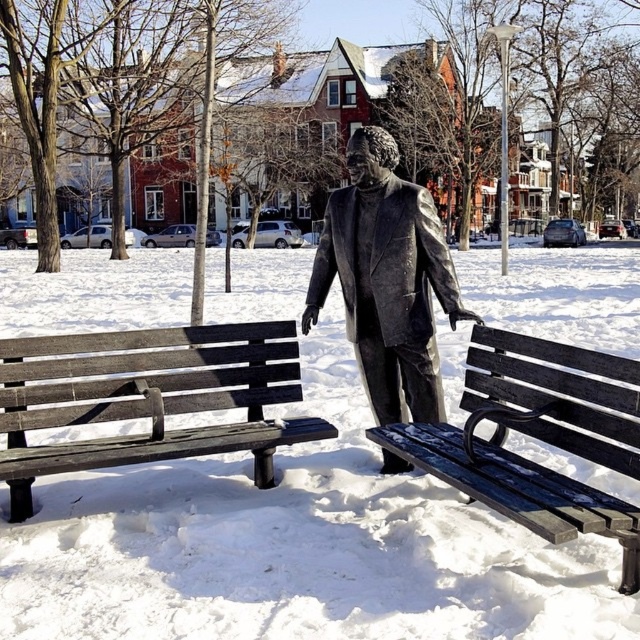
Between point (339, 422) and point (234, 348), which one is positioned in front?

Point (234, 348)

Who is higher up, white matte snow at center or wooden bench at left?

white matte snow at center is above.

Is point (339, 307) positioned after point (76, 456)?

Yes, point (339, 307) is behind point (76, 456).

What are the coordinates of `white matte snow at center` in the screenshot? It's located at (296, 545).

Does white matte snow at center come in front of bronze statue at center?

Yes, it is.

Measure the distance between white matte snow at center and camera.

white matte snow at center is 8.83 feet away from camera.

I want to click on white matte snow at center, so click(296, 545).

Is white matte snow at center below dark wood bench at center?

Incorrect, white matte snow at center is not positioned below dark wood bench at center.

Which of these two, white matte snow at center or dark wood bench at center, stands taller?

With more height is white matte snow at center.

Does point (168, 496) come closer to viewer compared to point (520, 476)?

That is False.

Find the location of `white matte snow at center`. white matte snow at center is located at coordinates (296, 545).